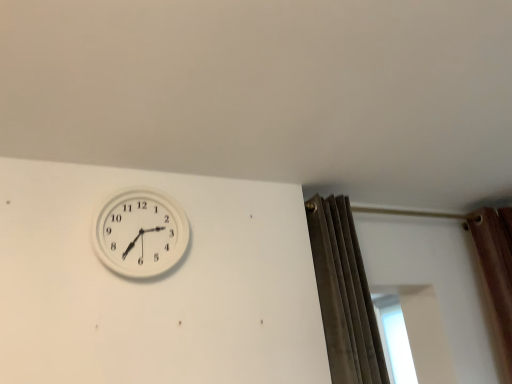
Question: Would you say white plastic wall clock at upper left contains velvet gray curtain at right?

Choices:
 (A) no
 (B) yes

Answer: (A)

Question: Is white plastic wall clock at upper left at the right side of velvet gray curtain at right?

Choices:
 (A) yes
 (B) no

Answer: (B)

Question: Does white plastic wall clock at upper left have a larger size compared to velvet gray curtain at right?

Choices:
 (A) no
 (B) yes

Answer: (A)

Question: Is white plastic wall clock at upper left oriented towards velvet gray curtain at right?

Choices:
 (A) yes
 (B) no

Answer: (B)

Question: From a real-world perspective, does white plastic wall clock at upper left sit lower than velvet gray curtain at right?

Choices:
 (A) yes
 (B) no

Answer: (B)

Question: Does white plastic wall clock at upper left come in front of velvet gray curtain at right?

Choices:
 (A) yes
 (B) no

Answer: (A)

Question: Considering the relative sizes of velvet gray curtain at right and white plastic wall clock at upper left in the image provided, is velvet gray curtain at right smaller than white plastic wall clock at upper left?

Choices:
 (A) no
 (B) yes

Answer: (A)

Question: Does velvet gray curtain at right have a greater width compared to white plastic wall clock at upper left?

Choices:
 (A) no
 (B) yes

Answer: (B)

Question: Is velvet gray curtain at right oriented away from white plastic wall clock at upper left?

Choices:
 (A) no
 (B) yes

Answer: (A)

Question: Does velvet gray curtain at right have a lesser height compared to white plastic wall clock at upper left?

Choices:
 (A) yes
 (B) no

Answer: (B)

Question: From the image's perspective, is velvet gray curtain at right over white plastic wall clock at upper left?

Choices:
 (A) yes
 (B) no

Answer: (B)

Question: Is velvet gray curtain at right directly adjacent to white plastic wall clock at upper left?

Choices:
 (A) yes
 (B) no

Answer: (B)

Question: Is velvet gray curtain at right situated inside white plastic wall clock at upper left or outside?

Choices:
 (A) outside
 (B) inside

Answer: (A)